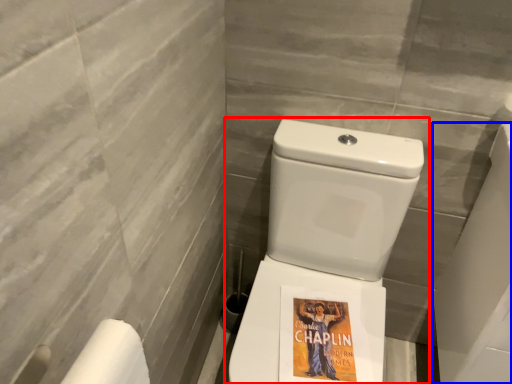
Question: Which point is closer to the camera, toilet (highlighted by a red box) or porcelain (highlighted by a blue box)?

Choices:
 (A) toilet
 (B) porcelain

Answer: (A)